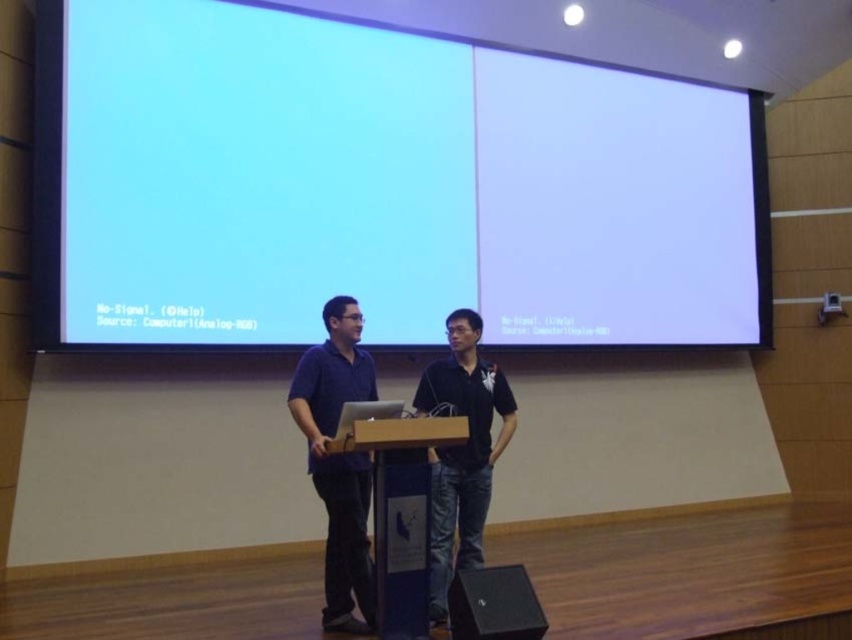
Between dark blue shirt at center and black matte shirt at center, which one is positioned lower?

black matte shirt at center

Can you confirm if dark blue shirt at center is wider than black matte shirt at center?

In fact, dark blue shirt at center might be narrower than black matte shirt at center.

Is point (364, 580) closer to viewer compared to point (436, 536)?

Yes.

In order to click on dark blue shirt at center in this screenshot , I will do `click(338, 461)`.

Where is `white matte projection screen at upper center`? Image resolution: width=852 pixels, height=640 pixels. white matte projection screen at upper center is located at coordinates (383, 186).

Between white matte projection screen at upper center and black matte speaker at lower right, which one has less height?

Standing shorter between the two is black matte speaker at lower right.

Identify the location of white matte projection screen at upper center. This screenshot has width=852, height=640. (383, 186).

This screenshot has height=640, width=852. Find the location of `white matte projection screen at upper center`. white matte projection screen at upper center is located at coordinates (383, 186).

Who is lower down, black matte shirt at center or blue plastic podium at center?

blue plastic podium at center is below.

Is black matte shirt at center to the right of blue plastic podium at center from the viewer's perspective?

Indeed, black matte shirt at center is positioned on the right side of blue plastic podium at center.

You are a GUI agent. You are given a task and a screenshot of the screen. Output one action in this format:
    pyautogui.click(x=<x>, y=<y>)
    Task: Click on the black matte shirt at center
    The image size is (852, 640).
    Given the screenshot: What is the action you would take?
    pyautogui.click(x=461, y=452)